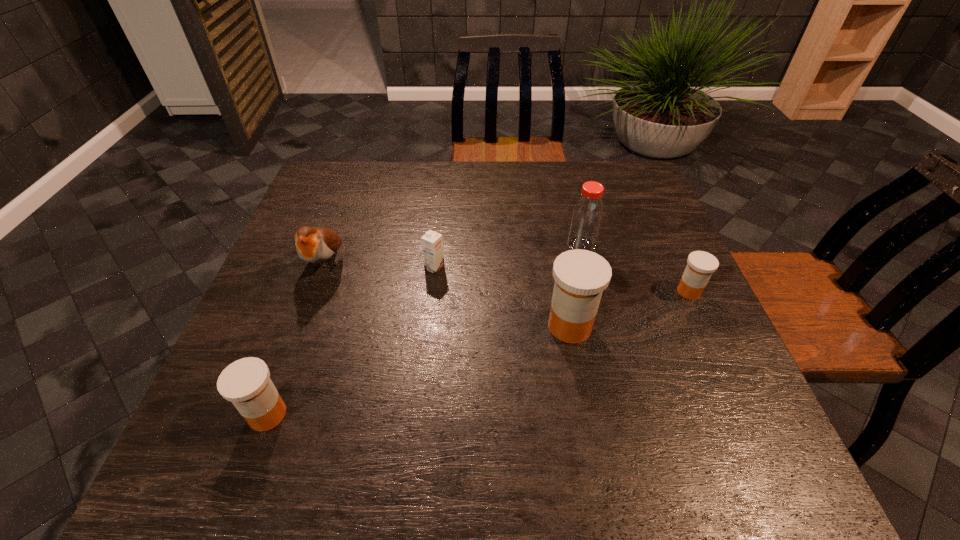
Locate an element on the screen. Image resolution: width=960 pixels, height=540 pixels. bird that is at the left edge is located at coordinates (316, 245).

At what (x,y) coordinates should I click in order to perform the action: click on object located at the right edge. Please return your answer as a coordinate pair (x, y). The image size is (960, 540). Looking at the image, I should click on (701, 265).

What are the coordinates of `object located in the near left corner section of the desktop` in the screenshot? It's located at (246, 383).

In the image, there is a desktop. Identify the location of free space at the far edge. (443, 163).

Identify the location of vacant space at the near edge of the desktop. (340, 400).

In the image, there is a desktop. Where is `vacant space at the left edge`? The width and height of the screenshot is (960, 540). vacant space at the left edge is located at coordinates (297, 313).

In the image, there is a desktop. Where is `vacant space at the right edge`? This screenshot has width=960, height=540. vacant space at the right edge is located at coordinates (631, 262).

Identify the location of vacant region at the far right corner of the desktop. The image size is (960, 540). (612, 187).

This screenshot has height=540, width=960. In order to click on free area in between the rightmost object and the bird in this screenshot , I will do `click(507, 278)`.

Image resolution: width=960 pixels, height=540 pixels. What are the coordinates of `free space between the rightmost medicine and the bottle` in the screenshot? It's located at (636, 268).